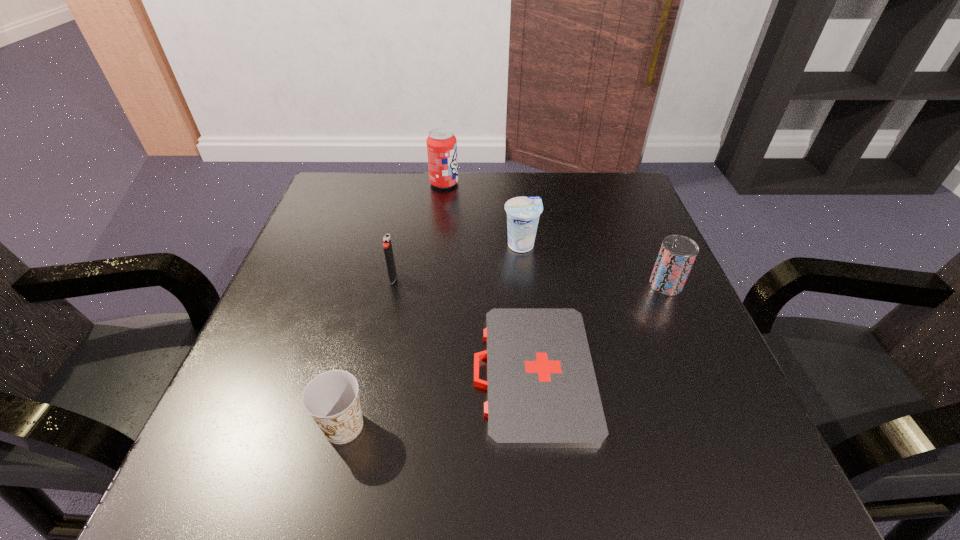
Find the location of a particular element. Image resolution: width=960 pixels, height=540 pixels. free space that satisfies the following two spatial constraints: 1. on the back side of the Dixie cup; 2. on the left side of the fifth nearest object is located at coordinates (388, 245).